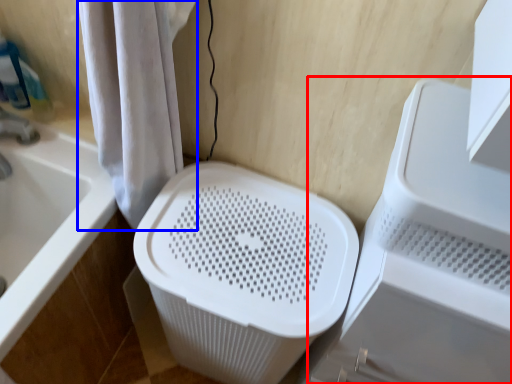
Question: Which of the following is the closest to the observer, appliance (highlighted by a red box) or shower curtain (highlighted by a blue box)?

Choices:
 (A) appliance
 (B) shower curtain

Answer: (B)